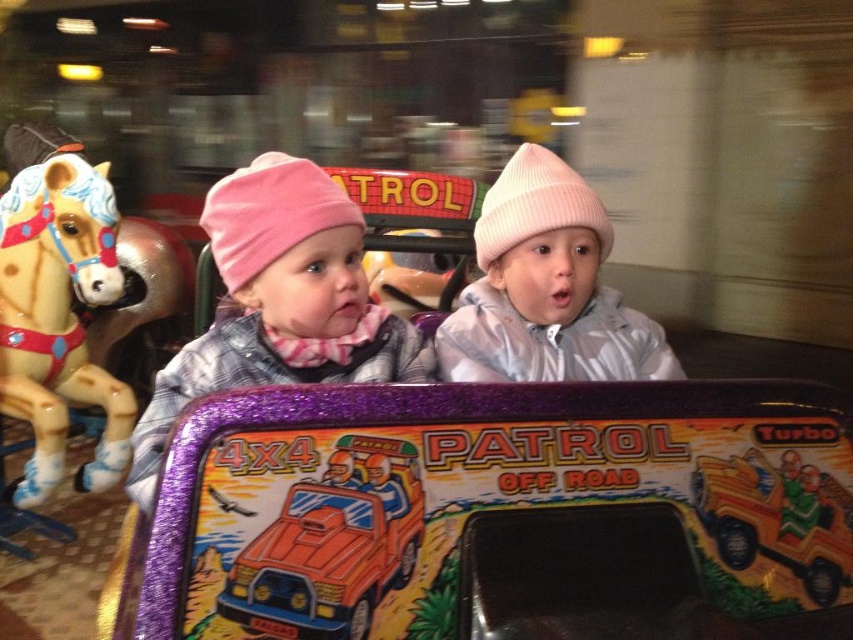
Looking at this image, two children are sitting in an amusement ride. The first child is wearing a pink hat and scarf, and the second child is wearing a white hat. They are sitting at point (161, 408). If you want to place a gift between them, how far apart should the gifts be placed?

The children are 3.84 feet apart, so the gifts should be placed 3.84 feet apart to be between them.

You are a parent trying to decide whether to buy a gift for your child. You see the pink knit hat at upper left and the orange matte plastic toy car at center in the image. If you want to give a gift that is bigger in size, which one should you choose?

The pink knit hat at upper left is larger in size than the orange matte plastic toy car at center, so you should choose the pink knit hat at upper left as the bigger gift.

You are standing in front of the 4x4 Patrol Off Road ride and see two points marked on the vehicle. Which point, point (308,273) or point (1,385), is closer to you?

Point (308,273) is closer to the viewer than point (1,385).